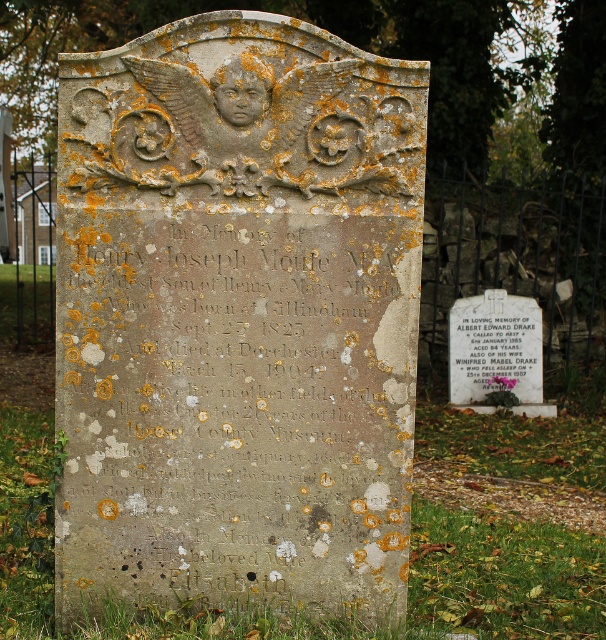
What are the coordinates of the speckled stone tombstone at center?

The coordinates of the speckled stone tombstone at center are at point (238, 316).

You are standing in a cemetery and see the point marked at coordinates (x=238, y=316). What is located at that point?

The point at coordinates (x=238, y=316) corresponds to the speckled stone tombstone at center.

You are standing in front of the gravestone and want to touch the point labeled as point [404,360]. Can you reach it without moving your position?

The point [404,360] is 11.76 feet away from the camera, so you cannot reach it without moving your position.